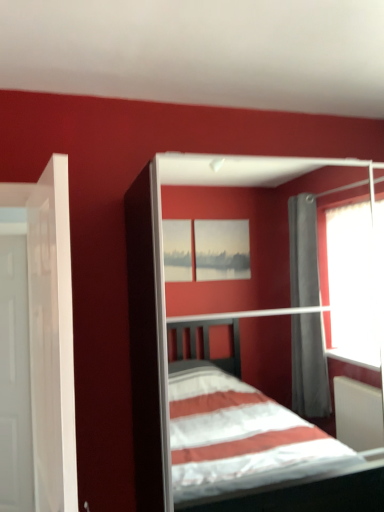
Question: In terms of height, does white glossy door at left, positioned as the second door in back-to-front order, look taller or shorter compared to white glossy door at left, the first door positioned from the back?

Choices:
 (A) tall
 (B) short

Answer: (B)

Question: From the image's perspective, relative to white glossy door at left, positioned as the 2th door in right-to-left order, is white glossy door at left, positioned as the second door in back-to-front order, above or below?

Choices:
 (A) below
 (B) above

Answer: (B)

Question: Based on their relative distances, which object is farther from the white glossy door at left, which is counted as the 1th door, starting from the front?

Choices:
 (A) white matte bed at center
 (B) white glossy door at left, positioned as the 2th door in right-to-left order

Answer: (A)

Question: Which of these objects is positioned farthest from the white glossy door at left, marked as the second door in a front-to-back arrangement?

Choices:
 (A) white glossy door at left, positioned as the second door in back-to-front order
 (B) white matte bed at center

Answer: (B)